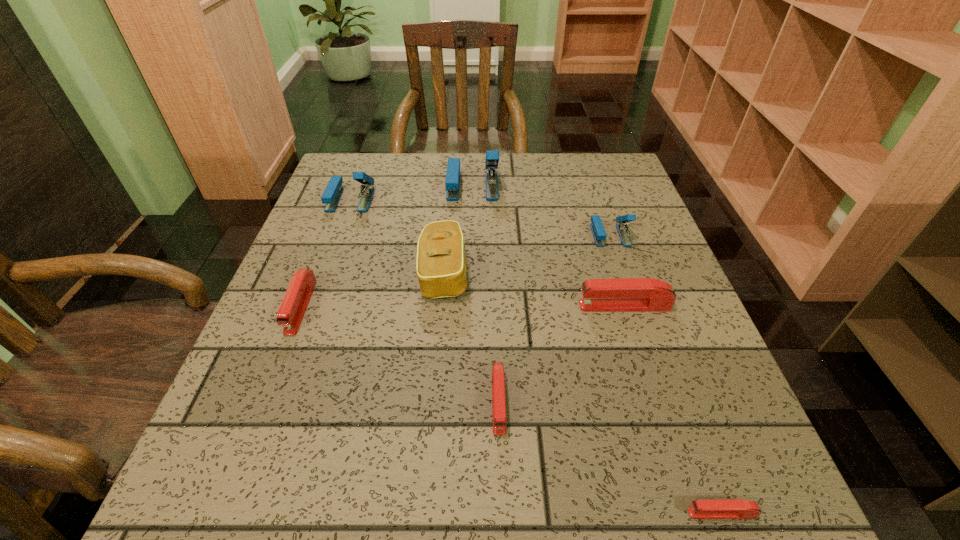
I want to click on the biggest blue stapler, so [x=452, y=183].

Where is `the second blue stapler from left to right`? the second blue stapler from left to right is located at coordinates (452, 183).

This screenshot has height=540, width=960. I want to click on the leftmost blue stapler, so click(x=332, y=193).

Identify the location of the second biggest blue stapler. This screenshot has height=540, width=960. (332, 193).

What are the coordinates of `clutch bag` in the screenshot? It's located at (441, 269).

Find the location of a particular element. The height and width of the screenshot is (540, 960). the smallest blue stapler is located at coordinates point(597,228).

You are a GUI agent. You are given a task and a screenshot of the screen. Output one action in this format:
    pyautogui.click(x=<x>, y=<y>)
    Task: Click on the nearest blue stapler
    
    Given the screenshot: What is the action you would take?
    pyautogui.click(x=597, y=228)

The width and height of the screenshot is (960, 540). I want to click on the biggest red stapler, so click(x=622, y=294).

Image resolution: width=960 pixels, height=540 pixels. I want to click on the second biggest red stapler, so click(292, 309).

Image resolution: width=960 pixels, height=540 pixels. In order to click on the third shortest stapler in this screenshot , I will do `click(292, 309)`.